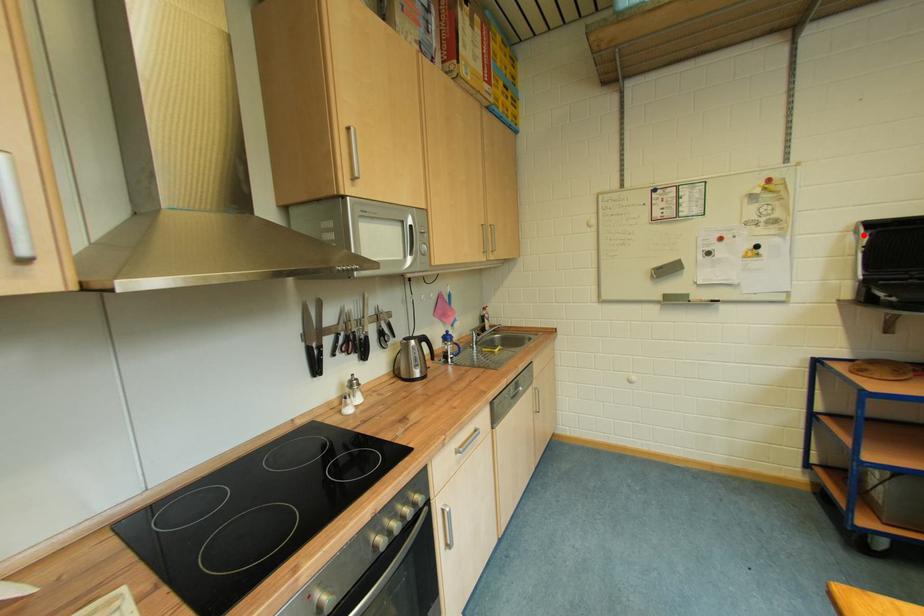
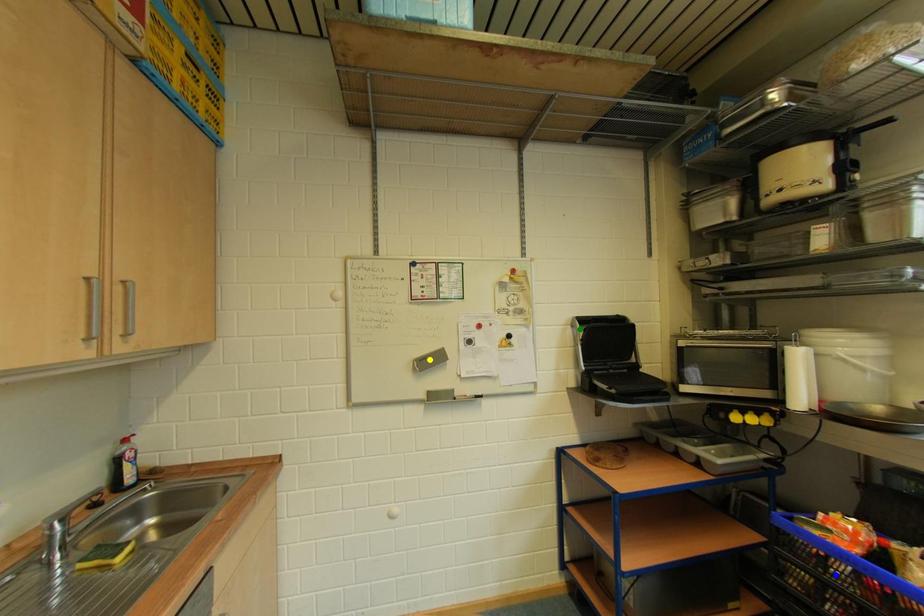
Question: I am providing you with two images of the same scene from different viewpoints. A red point is marked on the first image. You are given multiple points on the second image. In image 2, which mark is for the same physical point as the one in image 1?

Choices:
 (A) yellow point
 (B) green point
 (C) blue point

Answer: (B)